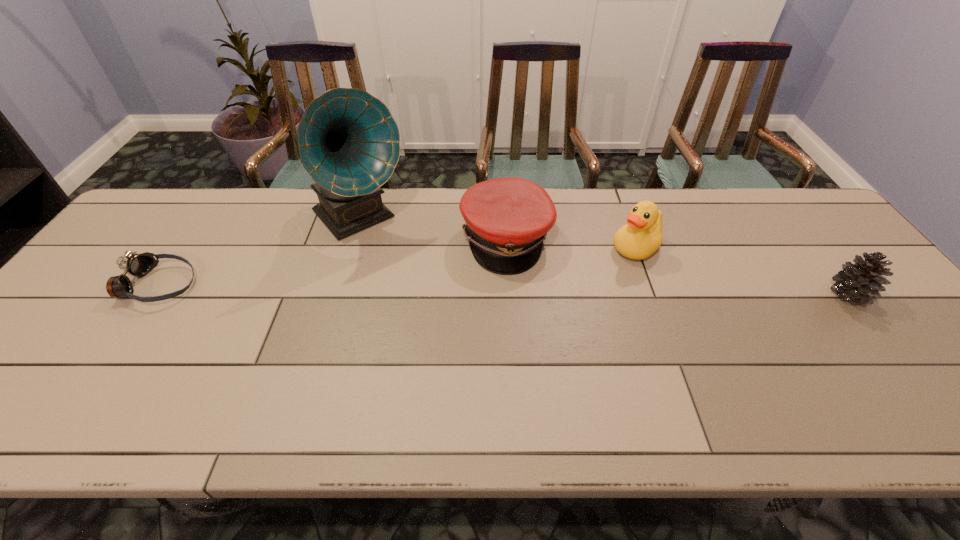
The width and height of the screenshot is (960, 540). In order to click on free location located 0.180m at the beak of the fourth object from left to right in this screenshot , I will do `click(578, 291)`.

This screenshot has height=540, width=960. What are the coordinates of `vacant space located at the beak of the fourth object from left to right` in the screenshot? It's located at (557, 307).

This screenshot has height=540, width=960. I want to click on vacant region located at the beak of the fourth object from left to right, so click(x=563, y=302).

Identify the location of free spot located 0.140m from the horn of the phonograph_record. (411, 274).

Where is `free space located from the horn of the phonograph_record`? This screenshot has width=960, height=540. free space located from the horn of the phonograph_record is located at coordinates (424, 289).

Identify the location of vacant space located 0.300m from the horn of the phonograph_record. The image size is (960, 540). (444, 310).

Identify the location of free spot located at the front of the cap where the visor is located. The image size is (960, 540). (564, 275).

The height and width of the screenshot is (540, 960). In order to click on vacant space situated at the front of the cap where the visor is located in this screenshot , I will do `click(581, 285)`.

Identify the location of free space located 0.050m at the front of the cap where the visor is located. The height and width of the screenshot is (540, 960). (559, 272).

Locate an element on the screen. This screenshot has width=960, height=540. duck that is at the far edge is located at coordinates (642, 235).